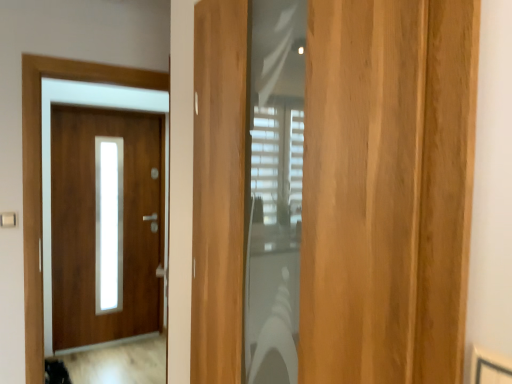
Question: Which direction should I rotate to look at light brown wood door at center, the 2th door when ordered from back to front?

Choices:
 (A) right
 (B) left

Answer: (A)

Question: Can you confirm if matte wood door at left, which is the second door in right-to-left order, is smaller than light brown wood door at center, which ranks as the second door in left-to-right order?

Choices:
 (A) no
 (B) yes

Answer: (A)

Question: Is matte wood door at left, marked as the 1th door in a left-to-right arrangement, completely or partially outside of light brown wood door at center, the first door in the right-to-left sequence?

Choices:
 (A) no
 (B) yes

Answer: (B)

Question: Considering the relative positions of matte wood door at left, placed as the 1th door when sorted from back to front, and light brown wood door at center, which ranks as the second door in left-to-right order, in the image provided, is matte wood door at left, placed as the 1th door when sorted from back to front, to the left of light brown wood door at center, which ranks as the second door in left-to-right order, from the viewer's perspective?

Choices:
 (A) no
 (B) yes

Answer: (B)

Question: From the image's perspective, is matte wood door at left, placed as the 1th door when sorted from back to front, under light brown wood door at center, which ranks as the second door in left-to-right order?

Choices:
 (A) yes
 (B) no

Answer: (A)

Question: Can you confirm if matte wood door at left, which is the second door in right-to-left order, is bigger than light brown wood door at center, the first door in the right-to-left sequence?

Choices:
 (A) no
 (B) yes

Answer: (B)

Question: Could you tell me if matte wood door at left, acting as the second door starting from the front, is turned towards light brown wood door at center, which ranks as the second door in left-to-right order?

Choices:
 (A) no
 (B) yes

Answer: (B)

Question: Does light brown wood door at center, the 2th door when ordered from back to front, contain matte wood door at left, which is the second door in right-to-left order?

Choices:
 (A) yes
 (B) no

Answer: (B)

Question: Considering the relative sizes of light brown wood door at center, which ranks as the second door in left-to-right order, and matte wood door at left, acting as the second door starting from the front, in the image provided, is light brown wood door at center, which ranks as the second door in left-to-right order, taller than matte wood door at left, acting as the second door starting from the front,?

Choices:
 (A) no
 (B) yes

Answer: (A)

Question: From the image's perspective, is light brown wood door at center, the 2th door when ordered from back to front, located beneath matte wood door at left, placed as the 1th door when sorted from back to front?

Choices:
 (A) yes
 (B) no

Answer: (B)

Question: Can you confirm if light brown wood door at center, which ranks as the second door in left-to-right order, is bigger than matte wood door at left, which is the second door in right-to-left order?

Choices:
 (A) no
 (B) yes

Answer: (A)

Question: Is light brown wood door at center, the 2th door when ordered from back to front, positioned far away from matte wood door at left, which is the second door in right-to-left order?

Choices:
 (A) no
 (B) yes

Answer: (B)

Question: Considering the relative sizes of light brown wood door at center, the 2th door when ordered from back to front, and matte wood door at left, which is the second door in right-to-left order, in the image provided, is light brown wood door at center, the 2th door when ordered from back to front, thinner than matte wood door at left, which is the second door in right-to-left order,?

Choices:
 (A) yes
 (B) no

Answer: (B)

Question: Is light brown wood door at center, which is the first door in front-to-back order, wider or thinner than matte wood door at left, which is the second door in right-to-left order?

Choices:
 (A) wide
 (B) thin

Answer: (A)